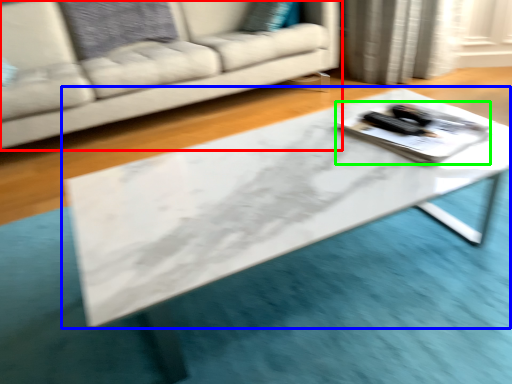
Question: Which object is the farthest from studio couch (highlighted by a red box)? Choose among these: table (highlighted by a blue box) or tray (highlighted by a green box).

Choices:
 (A) table
 (B) tray

Answer: (B)